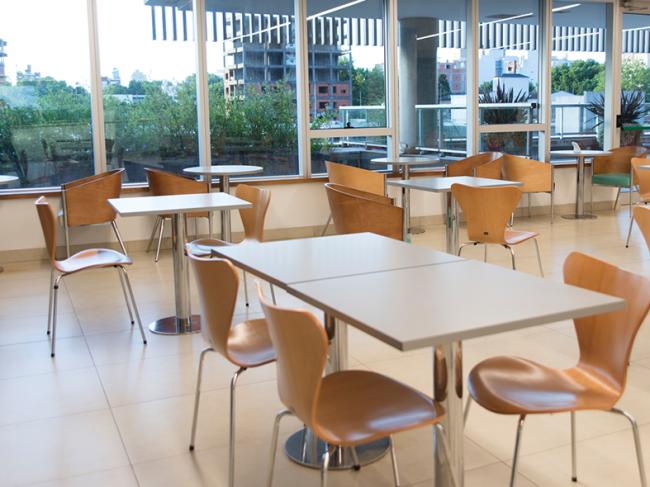
Where is `chair seats`? chair seats is located at coordinates (357, 405), (539, 389), (255, 342), (92, 255), (207, 242), (510, 233), (612, 176).